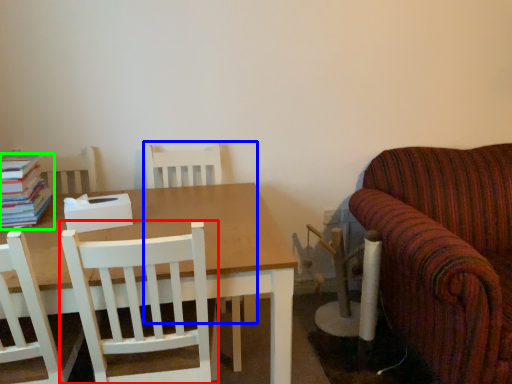
Question: Estimate the real-world distances between objects in this image. Which object is farther from chair (highlighted by a red box), chair (highlighted by a blue box) or book (highlighted by a green box)?

Choices:
 (A) chair
 (B) book

Answer: (A)